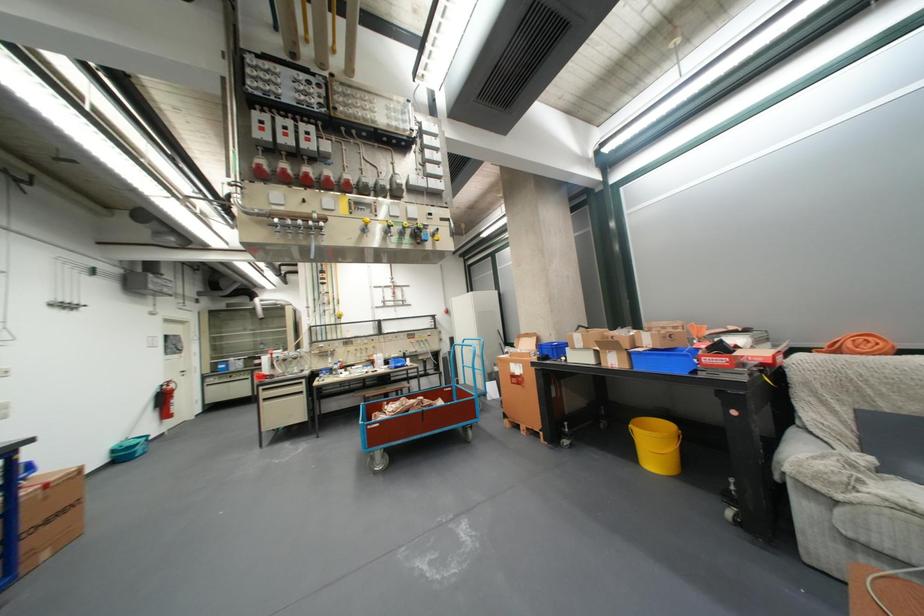
I want to click on red fire extinguisher, so click(166, 400).